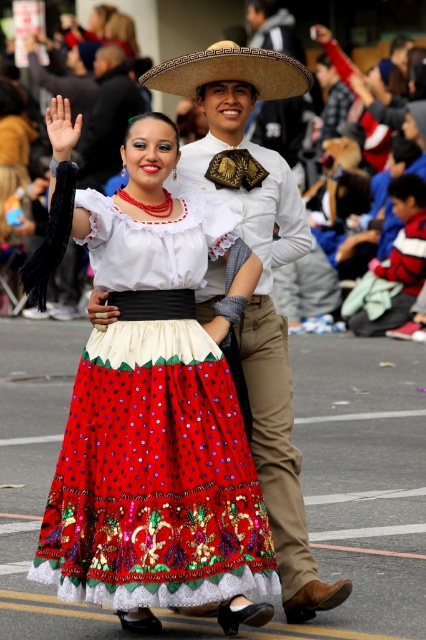
Question: Which point is farther to the camera?

Choices:
 (A) (268, 48)
 (B) (218, 49)
 (C) (258, 60)
 (D) (175, 324)

Answer: (A)

Question: Does brown woven straw hat at upper center appear on the right side of matte straw hat at center?

Choices:
 (A) yes
 (B) no

Answer: (B)

Question: Which object appears closest to the camera in this image?

Choices:
 (A) embroidered cotton skirt at center
 (B) matte straw hat at center
 (C) brown woven straw hat at upper center

Answer: (A)

Question: Is embroidered cotton skirt at center smaller than matte straw hat at center?

Choices:
 (A) yes
 (B) no

Answer: (B)

Question: Among these points, which one is nearest to the camera?

Choices:
 (A) (301, 84)
 (B) (282, 129)
 (C) (129, 237)

Answer: (C)

Question: Can you confirm if matte white shirt at center is wider than matte straw hat at center?

Choices:
 (A) yes
 (B) no

Answer: (A)